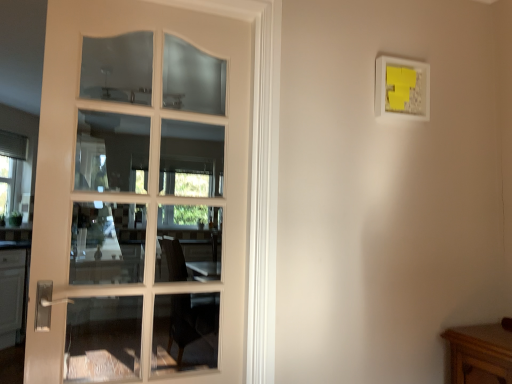
Question: Does wooden table at lower right appear on the left side of white glossy door at left?

Choices:
 (A) yes
 (B) no

Answer: (B)

Question: Is wooden table at lower right completely or partially outside of white glossy door at left?

Choices:
 (A) yes
 (B) no

Answer: (A)

Question: Could you tell me if wooden table at lower right is facing white glossy door at left?

Choices:
 (A) yes
 (B) no

Answer: (B)

Question: Is wooden table at lower right wider than white glossy door at left?

Choices:
 (A) yes
 (B) no

Answer: (A)

Question: From a real-world perspective, is wooden table at lower right beneath white glossy door at left?

Choices:
 (A) no
 (B) yes

Answer: (B)

Question: Looking at the image, does white glossy door at left seem bigger or smaller compared to white matte picture frame at upper right?

Choices:
 (A) big
 (B) small

Answer: (A)

Question: Do you think white glossy door at left is within white matte picture frame at upper right, or outside of it?

Choices:
 (A) outside
 (B) inside

Answer: (A)

Question: Is point (240, 334) positioned closer to the camera than point (428, 91)?

Choices:
 (A) farther
 (B) closer

Answer: (B)

Question: From a real-world perspective, is white glossy door at left above or below white matte picture frame at upper right?

Choices:
 (A) above
 (B) below

Answer: (B)

Question: In terms of width, does white glossy door at left look wider or thinner when compared to wooden table at lower right?

Choices:
 (A) thin
 (B) wide

Answer: (A)

Question: From a real-world perspective, is white glossy door at left above or below wooden table at lower right?

Choices:
 (A) below
 (B) above

Answer: (B)

Question: In terms of size, does white glossy door at left appear bigger or smaller than wooden table at lower right?

Choices:
 (A) big
 (B) small

Answer: (A)

Question: From the image's perspective, relative to wooden table at lower right, is white glossy door at left above or below?

Choices:
 (A) above
 (B) below

Answer: (A)

Question: In the image, is wooden table at lower right on the left side or the right side of white matte picture frame at upper right?

Choices:
 (A) right
 (B) left

Answer: (A)

Question: From a real-world perspective, is wooden table at lower right above or below white matte picture frame at upper right?

Choices:
 (A) above
 (B) below

Answer: (B)